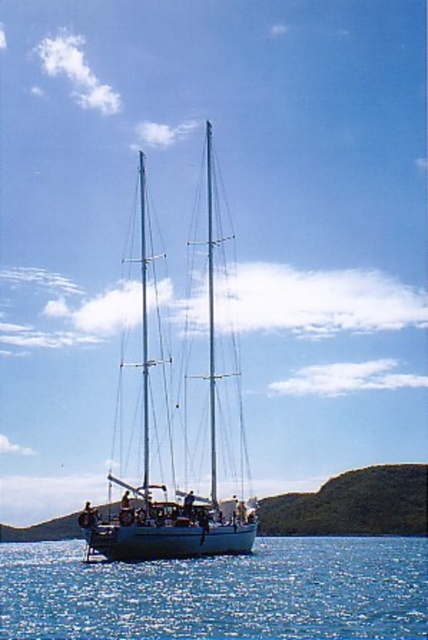
You are a photographer planning to capture the blue liquid water at center and the white glossy sailboat at center in a single shot. Based on their sizes in the image, which object will appear smaller in your photo?

The blue liquid water at center will appear smaller in the photo because it has a smaller size compared to the white glossy sailboat at center according to the description.

You are standing on the deck of the sailboat and looking down into the water. Which direction should you look to see the blue liquid water at center?

You should look directly downward because the blue liquid water at center is located at point coordinates of (x=220, y=592), which is directly below the boat.